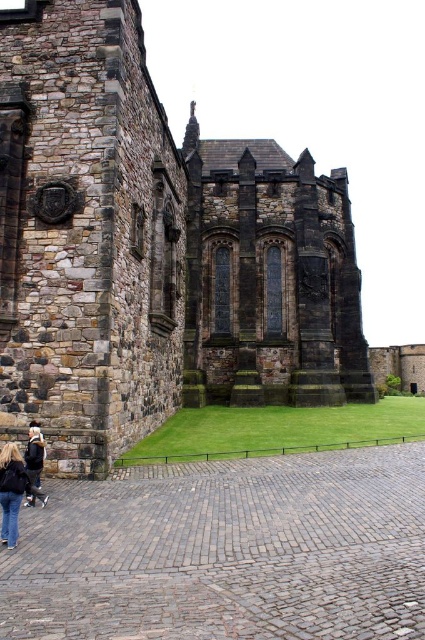
Can you confirm if rustic stone castle at center is smaller than denim jacket at lower left?

Incorrect, rustic stone castle at center is not smaller in size than denim jacket at lower left.

Between rustic stone castle at center and denim jacket at lower left, which one is positioned lower?

denim jacket at lower left is lower down.

Is point (221, 332) more distant than point (0, 477)?

Yes, it is.

This screenshot has width=425, height=640. Find the location of `rustic stone castle at center`. rustic stone castle at center is located at coordinates (153, 250).

Which of these two, rustic stone castle at center or dark brown leather jacket at lower left, stands taller?

rustic stone castle at center

Who is positioned more to the right, rustic stone castle at center or dark brown leather jacket at lower left?

rustic stone castle at center is more to the right.

You are a GUI agent. You are given a task and a screenshot of the screen. Output one action in this format:
    pyautogui.click(x=<x>, y=<y>)
    Task: Click on the rustic stone castle at center
    The width and height of the screenshot is (425, 640).
    Given the screenshot: What is the action you would take?
    pyautogui.click(x=153, y=250)

Is point (8, 445) in front of point (28, 429)?

That is True.

Is point (17, 513) positioned behind point (40, 461)?

No, it is in front of (40, 461).

Which is behind, point (22, 481) or point (47, 497)?

Positioned behind is point (47, 497).

Locate an element on the screen. denim jacket at lower left is located at coordinates (13, 492).